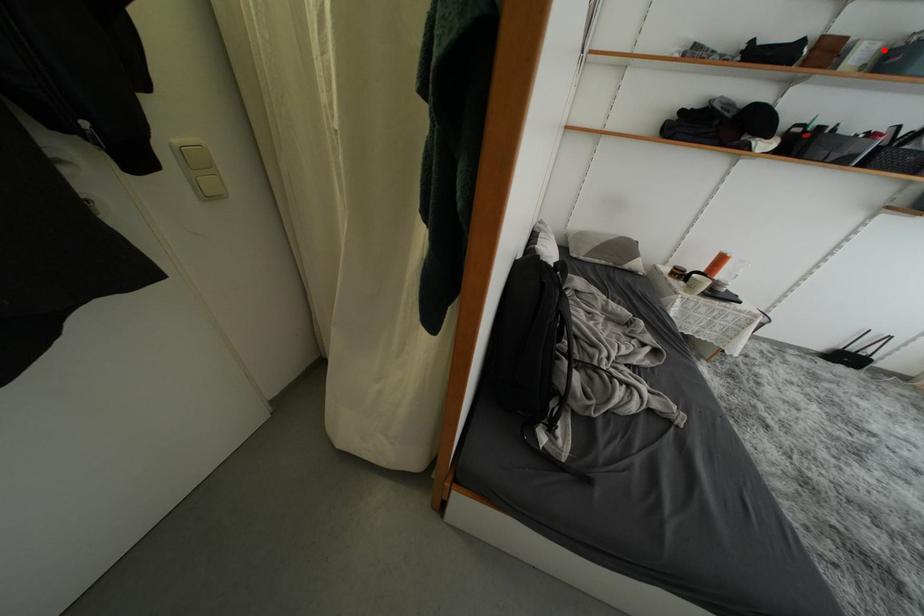
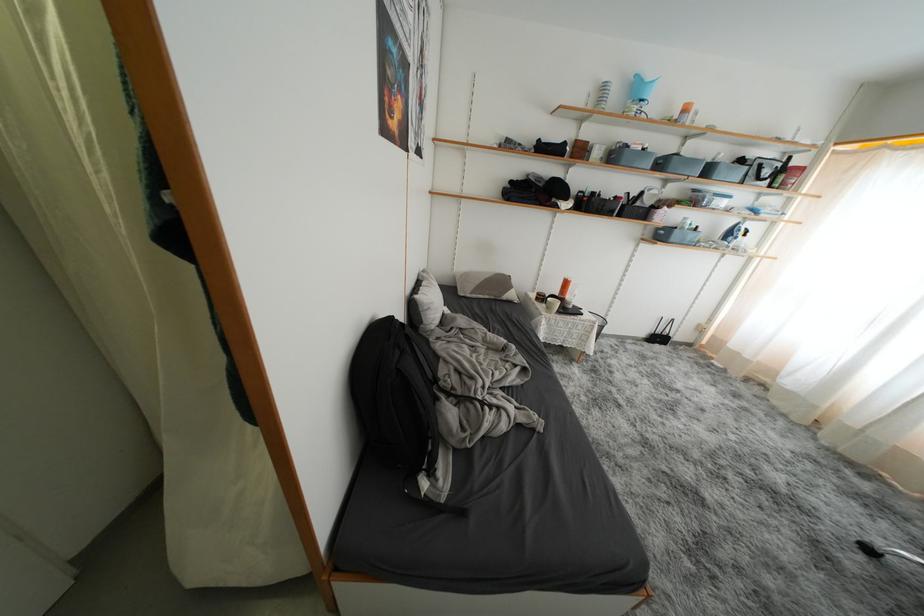
Question: I am providing you with two images of the same scene from different viewpoints. A red point is shown in image1. For the corresponding object point in image2, is it positioned nearer or farther from the camera?

Choices:
 (A) Nearer
 (B) Farther

Answer: (A)